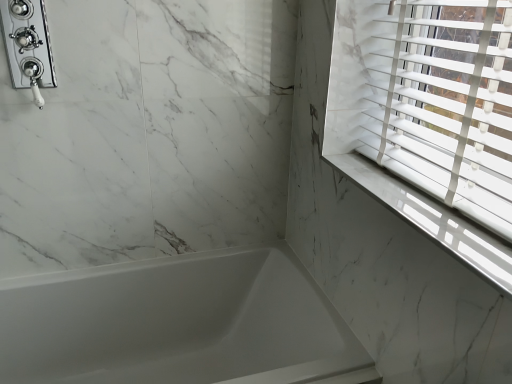
Question: Is white glossy bathtub at lower left smaller than chrome/polished metal shower at upper left?

Choices:
 (A) no
 (B) yes

Answer: (A)

Question: Is white glossy bathtub at lower left touching chrome/polished metal shower at upper left?

Choices:
 (A) no
 (B) yes

Answer: (A)

Question: From a real-world perspective, is white glossy bathtub at lower left positioned under chrome/polished metal shower at upper left based on gravity?

Choices:
 (A) yes
 (B) no

Answer: (A)

Question: Is white glossy bathtub at lower left aimed at chrome/polished metal shower at upper left?

Choices:
 (A) no
 (B) yes

Answer: (A)

Question: Is white glossy bathtub at lower left not within chrome/polished metal shower at upper left?

Choices:
 (A) no
 (B) yes

Answer: (B)

Question: From the image's perspective, does white glossy bathtub at lower left appear higher than chrome/polished metal shower at upper left?

Choices:
 (A) yes
 (B) no

Answer: (B)

Question: Is white glossy bathtub at lower left surrounded by white marble window sill at upper right?

Choices:
 (A) yes
 (B) no

Answer: (B)

Question: Is white marble window sill at upper right at the right side of white glossy bathtub at lower left?

Choices:
 (A) no
 (B) yes

Answer: (B)

Question: Is the depth of white marble window sill at upper right less than that of white glossy bathtub at lower left?

Choices:
 (A) no
 (B) yes

Answer: (B)

Question: Is white marble window sill at upper right oriented away from white glossy bathtub at lower left?

Choices:
 (A) no
 (B) yes

Answer: (A)

Question: Can we say white marble window sill at upper right lies outside white glossy bathtub at lower left?

Choices:
 (A) no
 (B) yes

Answer: (B)

Question: Is white marble window sill at upper right positioned behind white glossy bathtub at lower left?

Choices:
 (A) yes
 (B) no

Answer: (B)

Question: Is chrome/polished metal shower at upper left oriented towards white glossy bathtub at lower left?

Choices:
 (A) no
 (B) yes

Answer: (A)